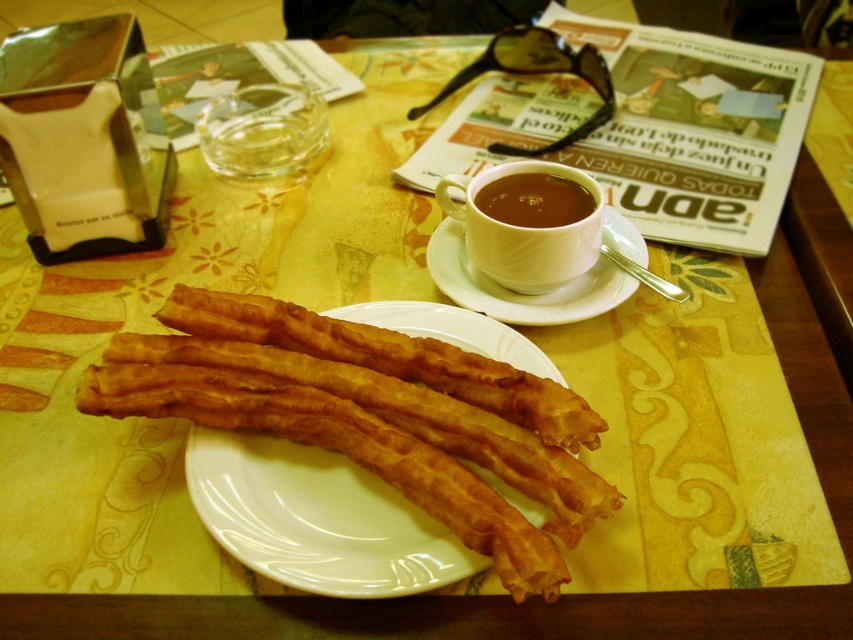
Does matte ceramic plate at center come in front of white ceramic saucer at upper center?

Yes, matte ceramic plate at center is closer to the viewer.

Who is taller, matte ceramic plate at center or white ceramic saucer at upper center?

matte ceramic plate at center is taller.

Which is behind, point (402, 593) or point (619, 243)?

The point (619, 243) is behind.

This screenshot has height=640, width=853. I want to click on matte ceramic plate at center, so click(317, 518).

Which of these two, white ceramic cup at upper center or brown matte cup at upper center, stands shorter?

With less height is brown matte cup at upper center.

Between point (511, 276) and point (585, 200), which one is positioned in front?

Point (511, 276) is in front.

Identify the location of white ceramic cup at upper center. (524, 232).

Who is more distant from viewer, (440, 529) or (525, 195)?

Positioned behind is point (525, 195).

Does matte ceramic plate at center have a greater width compared to brown matte cup at upper center?

Yes, matte ceramic plate at center is wider than brown matte cup at upper center.

Locate an element on the screen. The width and height of the screenshot is (853, 640). matte ceramic plate at center is located at coordinates (317, 518).